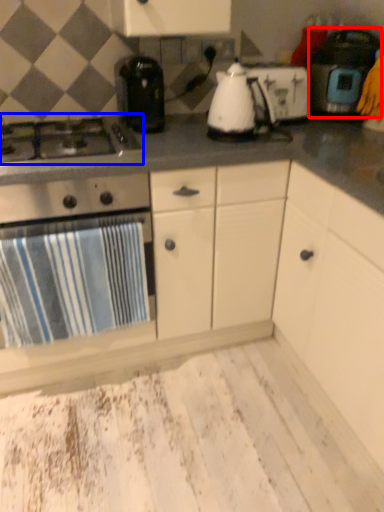
Question: Which object is further to the camera taking this photo, kitchen appliance (highlighted by a red box) or gas stove (highlighted by a blue box)?

Choices:
 (A) kitchen appliance
 (B) gas stove

Answer: (A)